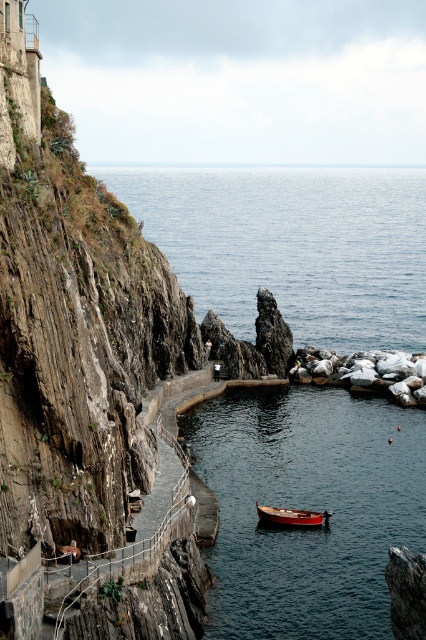
Does point (244, 472) come behind point (331, 324)?

No, (244, 472) is in front of (331, 324).

Does smooth dark water at center come in front of blue water at center?

Yes, it is.

Which is in front, point (316, 547) or point (313, 252)?

Point (316, 547) is in front.

Find the location of `smooth dark water at center`. smooth dark water at center is located at coordinates coord(307,508).

Is blue water at center further to camera compared to gray rock at lower right?

Yes, blue water at center is behind gray rock at lower right.

Is point (192, 168) closer to viewer compared to point (351, 385)?

No, (192, 168) is behind (351, 385).

Find the location of `blue water at center`. blue water at center is located at coordinates (291, 244).

Does gray rock at lower right have a smaller size compared to wooden boat at center?

No.

Between gray rock at lower right and wooden boat at center, which one is positioned lower?

wooden boat at center is lower down.

This screenshot has width=426, height=640. What do you see at coordinates (365, 372) in the screenshot?
I see `gray rock at lower right` at bounding box center [365, 372].

Locate an element on the screen. The width and height of the screenshot is (426, 640). gray rock at lower right is located at coordinates (365, 372).